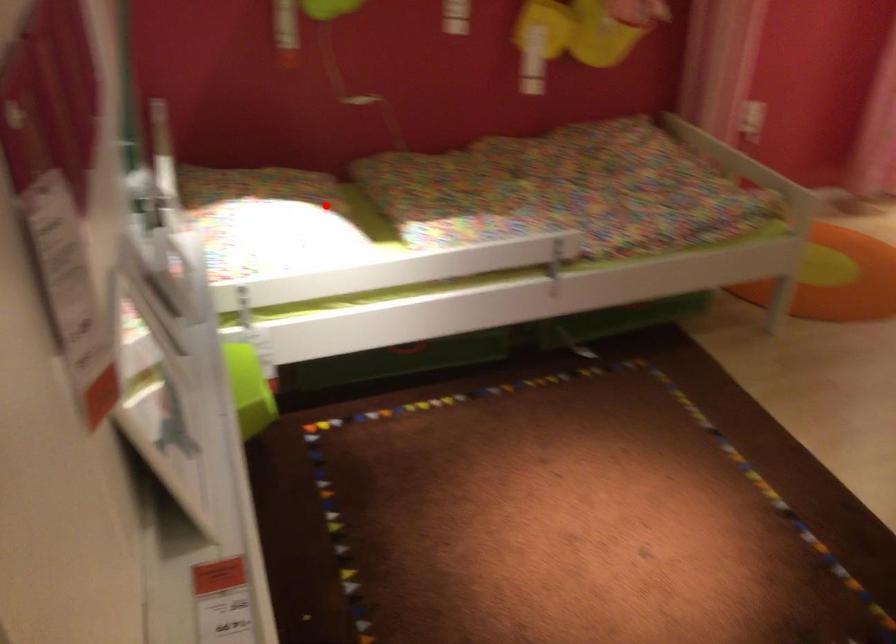
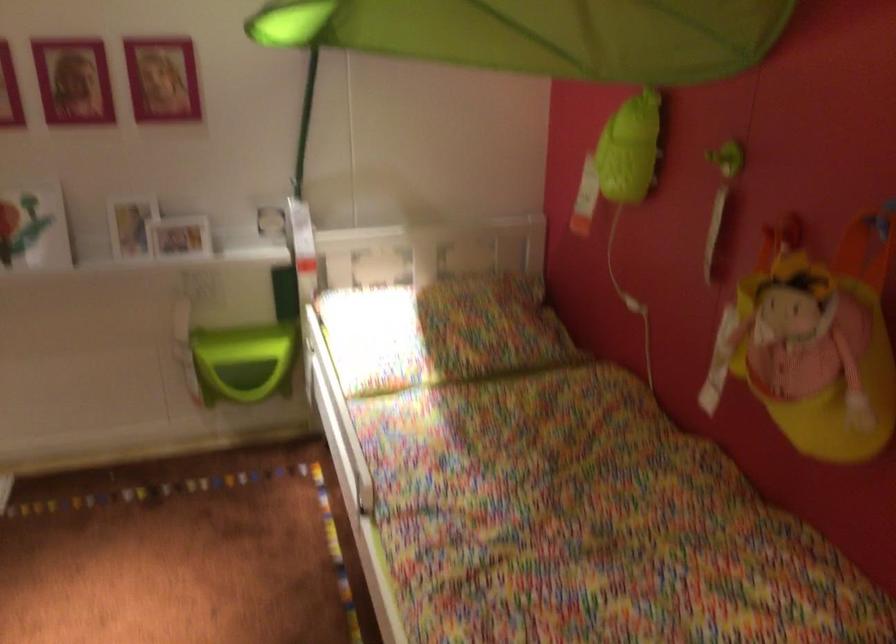
Where in the second image is the point corresponding to the highlighted location from the first image?

(440, 332)